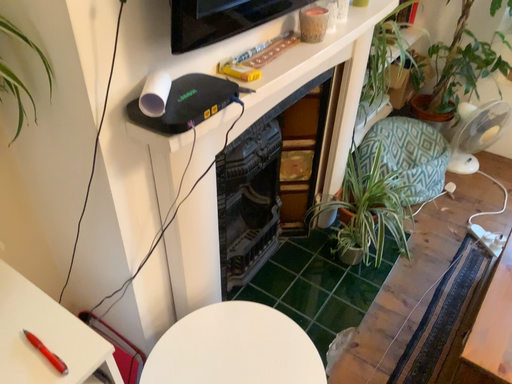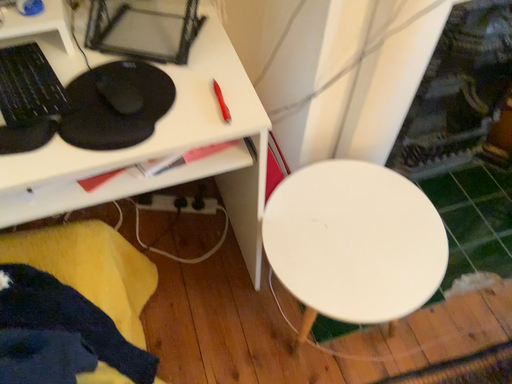
Question: Which way did the camera rotate in the video?

Choices:
 (A) rotated downward
 (B) rotated upward

Answer: (A)